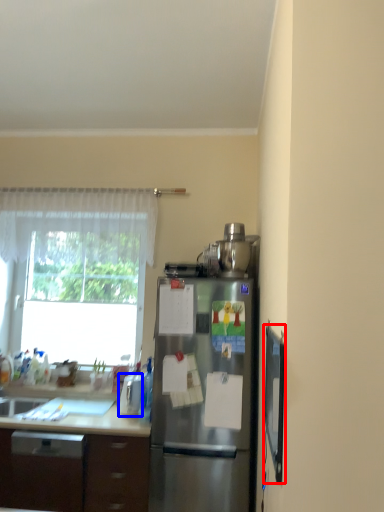
Question: Which object is closer to the camera taking this photo, screen door (highlighted by a red box) or appliance (highlighted by a blue box)?

Choices:
 (A) screen door
 (B) appliance

Answer: (A)